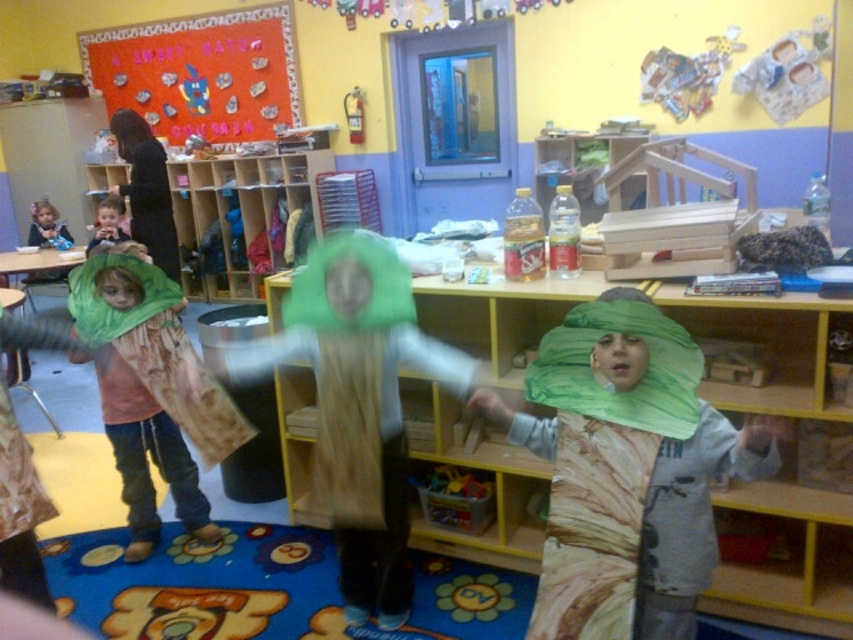
Question: Estimate the real-world distances between objects in this image. Which object is closer to the matte green leaf at center?

Choices:
 (A) green fabric head at center
 (B) green fabric tree at left

Answer: (A)

Question: Is green fabric tree at left below green fabric headband at upper center?

Choices:
 (A) yes
 (B) no

Answer: (A)

Question: Considering the real-world distances, which object is closest to the green fabric head at center?

Choices:
 (A) green fabric tree at left
 (B) matte green leaf at center

Answer: (A)

Question: Is green fabric head at center further to the viewer compared to green fabric tree at left?

Choices:
 (A) no
 (B) yes

Answer: (A)

Question: Where is green fabric tree at left located in relation to green fabric headband at upper center in the image?

Choices:
 (A) right
 (B) left

Answer: (A)

Question: Among these points, which one is nearest to the camera?

Choices:
 (A) (x=660, y=378)
 (B) (x=190, y=486)
 (C) (x=378, y=442)

Answer: (A)